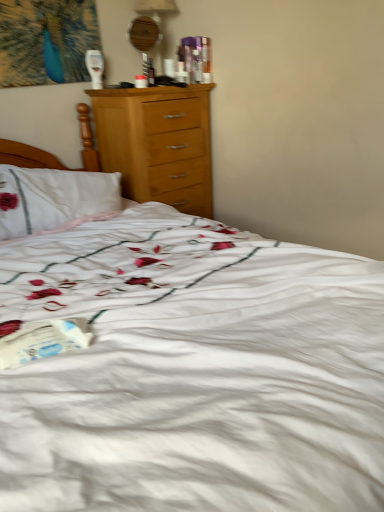
Image resolution: width=384 pixels, height=512 pixels. What do you see at coordinates (156, 8) in the screenshot?
I see `wooden table lamp at upper center` at bounding box center [156, 8].

Measure the distance between point (x=142, y=5) and camera.

A distance of 2.37 meters exists between point (x=142, y=5) and camera.

Find the location of a particular element. This screenshot has width=384, height=512. wooden table lamp at upper center is located at coordinates (156, 8).

What are the coordinates of `white paper at lower left` in the screenshot? It's located at (43, 340).

What is the approximate width of white paper at lower left?

The width of white paper at lower left is 9.36 inches.

What do you see at coordinates (43, 340) in the screenshot?
I see `white paper at lower left` at bounding box center [43, 340].

The width and height of the screenshot is (384, 512). Find the location of `wooden table lamp at upper center`. wooden table lamp at upper center is located at coordinates (x=156, y=8).

Considering the relative positions of wooden table lamp at upper center and white paper at lower left in the image provided, is wooden table lamp at upper center to the right of white paper at lower left from the viewer's perspective?

Indeed, wooden table lamp at upper center is positioned on the right side of white paper at lower left.

Between wooden table lamp at upper center and white paper at lower left, which one is positioned behind?

Positioned behind is wooden table lamp at upper center.

Does point (163, 2) appear closer or farther from the camera than point (58, 338)?

Point (163, 2).

From the image's perspective, is wooden table lamp at upper center above or below white paper at lower left?

From the image's perspective, wooden table lamp at upper center appears above white paper at lower left.

From a real-world perspective, does wooden table lamp at upper center sit lower than white paper at lower left?

Incorrect, from a real-world perspective, wooden table lamp at upper center is higher than white paper at lower left.

Can you confirm if wooden table lamp at upper center is wider than white paper at lower left?

In fact, wooden table lamp at upper center might be narrower than white paper at lower left.

Is wooden table lamp at upper center shorter than white paper at lower left?

Incorrect, the height of wooden table lamp at upper center does not fall short of that of white paper at lower left.

In the scene shown: Can you confirm if wooden table lamp at upper center is smaller than white paper at lower left?

No.

Is wooden table lamp at upper center not within white paper at lower left?

wooden table lamp at upper center is positioned outside white paper at lower left.

Is wooden table lamp at upper center far away from white paper at lower left?

wooden table lamp at upper center is positioned a significant distance from white paper at lower left.

Is wooden table lamp at upper center looking in the opposite direction of white paper at lower left?

wooden table lamp at upper center is not turned away from white paper at lower left.

How much distance is there between wooden table lamp at upper center and white paper at lower left?

They are 2.03 meters apart.

I want to click on paperback book on the left of wooden table lamp at upper center, so click(43, 340).

Is white paper at lower left to the left or to the right of wooden table lamp at upper center in the image?

Clearly, white paper at lower left is on the left of wooden table lamp at upper center in the image.

Which object is further away from the camera, white paper at lower left or wooden table lamp at upper center?

wooden table lamp at upper center is further away from the camera.

Does point (64, 347) lie behind point (156, 8)?

No, it is in front of (156, 8).

From the image's perspective, which is below, white paper at lower left or wooden table lamp at upper center?

white paper at lower left.

Looking at this image, from a real-world perspective, is white paper at lower left located higher than wooden table lamp at upper center?

No.

Is white paper at lower left wider than wooden table lamp at upper center?

Yes, white paper at lower left is wider than wooden table lamp at upper center.

Between white paper at lower left and wooden table lamp at upper center, which one has less height?

white paper at lower left.

Looking at this image, considering the sizes of white paper at lower left and wooden table lamp at upper center in the image, is white paper at lower left bigger or smaller than wooden table lamp at upper center?

In the image, white paper at lower left appears to be smaller than wooden table lamp at upper center.

Is white paper at lower left outside of wooden table lamp at upper center?

white paper at lower left is positioned outside wooden table lamp at upper center.

Does white paper at lower left touch wooden table lamp at upper center?

No, white paper at lower left is not next to wooden table lamp at upper center.

Is white paper at lower left turned away from wooden table lamp at upper center?

That's not correct — white paper at lower left is not looking away from wooden table lamp at upper center.

How many degrees apart are the facing directions of white paper at lower left and wooden table lamp at upper center?

white paper at lower left and wooden table lamp at upper center are facing 108 degrees away from each other.

Identify the location of table lamp above the white paper at lower left (from a real-world perspective). (156, 8).

Where is `paperback book below the wooden table lamp at upper center (from a real-world perspective)`? The height and width of the screenshot is (512, 384). paperback book below the wooden table lamp at upper center (from a real-world perspective) is located at coordinates pyautogui.click(x=43, y=340).

What are the coordinates of `table lamp above the white paper at lower left (from the image's perspective)` in the screenshot? It's located at (156, 8).